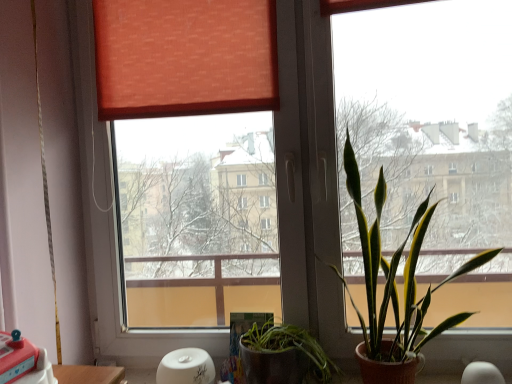
Question: Is green leafy plant at right beside wooden table at lower left?

Choices:
 (A) no
 (B) yes

Answer: (A)

Question: Does green leafy plant at right have a lesser width compared to wooden table at lower left?

Choices:
 (A) yes
 (B) no

Answer: (B)

Question: Is green leafy plant at right shorter than wooden table at lower left?

Choices:
 (A) no
 (B) yes

Answer: (A)

Question: Is green leafy plant at right further to the viewer compared to wooden table at lower left?

Choices:
 (A) no
 (B) yes

Answer: (A)

Question: Can we say green leafy plant at right lies outside wooden table at lower left?

Choices:
 (A) yes
 (B) no

Answer: (A)

Question: Considering the relative sizes of green leafy plant at right and wooden table at lower left in the image provided, is green leafy plant at right wider than wooden table at lower left?

Choices:
 (A) no
 (B) yes

Answer: (B)

Question: Is wooden table at lower left taller than green leafy plant at right?

Choices:
 (A) no
 (B) yes

Answer: (A)

Question: Is wooden table at lower left far away from green leafy plant at right?

Choices:
 (A) no
 (B) yes

Answer: (A)

Question: Is wooden table at lower left shorter than green leafy plant at right?

Choices:
 (A) yes
 (B) no

Answer: (A)

Question: Can we say wooden table at lower left lies outside green leafy plant at right?

Choices:
 (A) no
 (B) yes

Answer: (B)

Question: Is wooden table at lower left smaller than green leafy plant at right?

Choices:
 (A) yes
 (B) no

Answer: (A)

Question: From the image's perspective, does wooden table at lower left appear higher than green leafy plant at right?

Choices:
 (A) no
 (B) yes

Answer: (A)

Question: Is green leafy plant at right in front of or behind wooden table at lower left in the image?

Choices:
 (A) behind
 (B) front

Answer: (B)